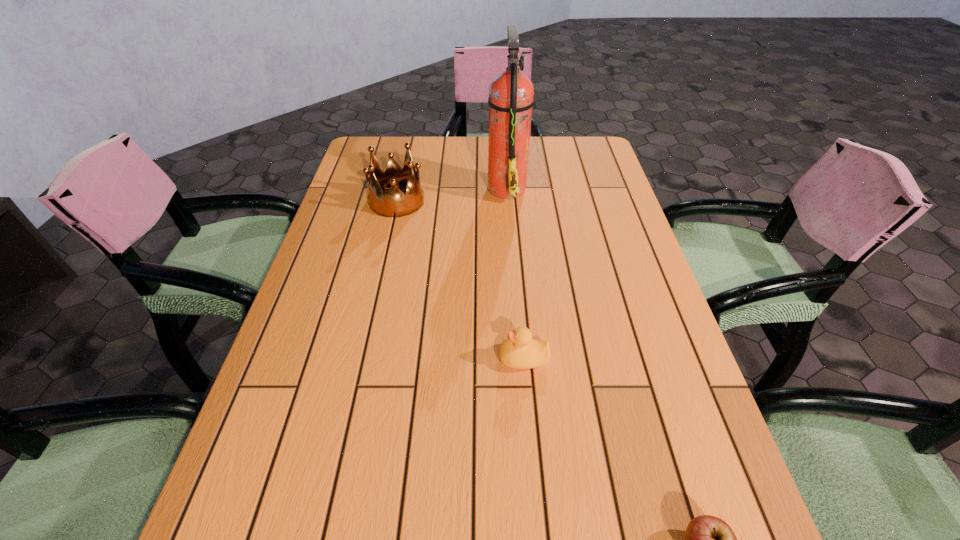
Locate an element on the screen. This screenshot has width=960, height=540. vacant space that is in between the duck and the leftmost object is located at coordinates (460, 280).

The height and width of the screenshot is (540, 960). I want to click on empty space that is in between the duck and the leftmost object, so click(460, 280).

Where is `the third closest object to the crown`? the third closest object to the crown is located at coordinates (x=708, y=539).

Identify which object is the second closest to the rightmost object. Please provide its 2D coordinates. Your answer should be formatted as a tuple, i.e. [(x, y)], where the tuple contains the x and y coordinates of a point satisfying the conditions above.

[(511, 93)]

Where is `vacant space that satisfies the following two spatial constraints: 1. at the nozzle of the tallest object; 2. on the front side of the crown`? vacant space that satisfies the following two spatial constraints: 1. at the nozzle of the tallest object; 2. on the front side of the crown is located at coordinates pyautogui.click(x=508, y=201).